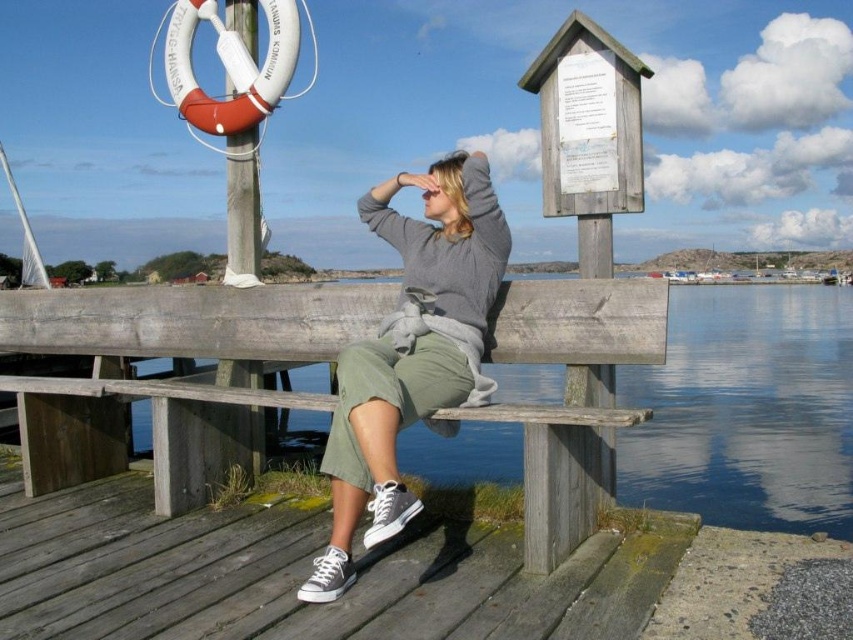
You are standing on the pier and want to take a photo of the gray cotton sweater at center without the transparent blue water at lower center in the background. Is this possible?

The gray cotton sweater at center is behind the transparent blue water at lower center, so you cannot take a photo of the gray cotton sweater at center without the transparent blue water at lower center in the background.

You are standing at the edge of the pier and want to reach a specific point marked at coordinates point (x=627, y=452). If you can walk 10 meters before needing to rest, will you be able to reach this point without resting?

The distance of point (x=627, y=452) from viewer is 8.52 meters. Since you can walk 10 meters before needing to rest, you can reach the point without resting.

What is the 2D coordinate of the transparent blue water at lower center in the image?

The 2D coordinate of the transparent blue water at lower center is at point (746, 410).